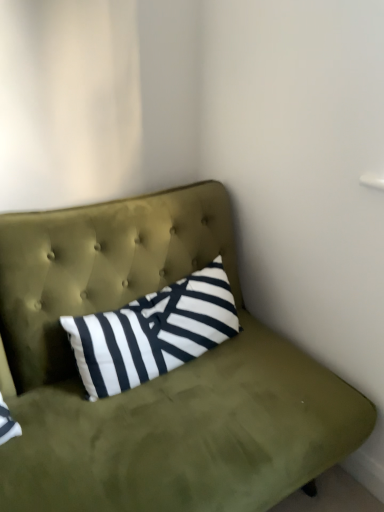
Question: From the image's perspective, is olive green fabric studio couch at upper center located above black and white striped pillow at center?

Choices:
 (A) yes
 (B) no

Answer: (B)

Question: Is olive green fabric studio couch at upper center next to black and white striped pillow at center?

Choices:
 (A) no
 (B) yes

Answer: (A)

Question: Is olive green fabric studio couch at upper center facing away from black and white striped pillow at center?

Choices:
 (A) yes
 (B) no

Answer: (A)

Question: Does olive green fabric studio couch at upper center contain black and white striped pillow at center?

Choices:
 (A) no
 (B) yes

Answer: (B)

Question: Considering the relative positions of olive green fabric studio couch at upper center and black and white striped pillow at center in the image provided, is olive green fabric studio couch at upper center to the left of black and white striped pillow at center from the viewer's perspective?

Choices:
 (A) no
 (B) yes

Answer: (B)

Question: Is olive green fabric studio couch at upper center oriented towards black and white striped pillow at center?

Choices:
 (A) no
 (B) yes

Answer: (B)

Question: From a real-world perspective, is black and white striped pillow at center located higher than olive green fabric studio couch at upper center?

Choices:
 (A) no
 (B) yes

Answer: (B)

Question: Considering the relative sizes of black and white striped pillow at center and olive green fabric studio couch at upper center in the image provided, is black and white striped pillow at center wider than olive green fabric studio couch at upper center?

Choices:
 (A) no
 (B) yes

Answer: (A)

Question: Would you say black and white striped pillow at center is a long distance from olive green fabric studio couch at upper center?

Choices:
 (A) no
 (B) yes

Answer: (A)

Question: Does black and white striped pillow at center come behind olive green fabric studio couch at upper center?

Choices:
 (A) yes
 (B) no

Answer: (A)

Question: Is black and white striped pillow at center oriented towards olive green fabric studio couch at upper center?

Choices:
 (A) no
 (B) yes

Answer: (B)

Question: Considering the relative positions of black and white striped pillow at center and olive green fabric studio couch at upper center in the image provided, is black and white striped pillow at center to the right of olive green fabric studio couch at upper center from the viewer's perspective?

Choices:
 (A) no
 (B) yes

Answer: (B)

Question: Considering their positions, is olive green fabric studio couch at upper center located in front of or behind black and white striped pillow at center?

Choices:
 (A) behind
 (B) front

Answer: (B)